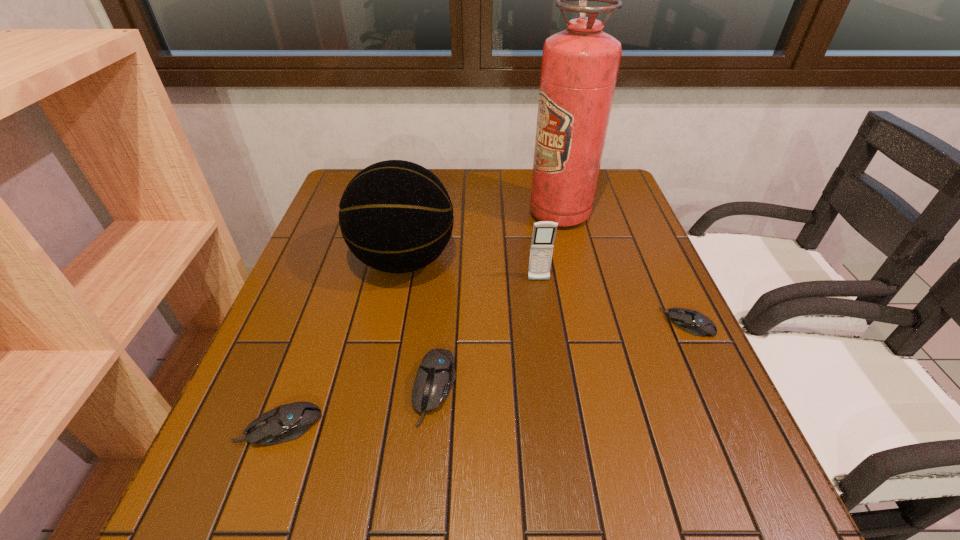
The width and height of the screenshot is (960, 540). I want to click on free space located on the back of the farthest computer mouse, so click(x=670, y=286).

Locate an element on the screen. Image resolution: width=960 pixels, height=540 pixels. free space located 0.060m on the right of the basketball is located at coordinates (479, 260).

Locate an element on the screen. vacant area situated on the label side of the tallest object is located at coordinates (468, 213).

Find the location of a particular element. This screenshot has width=960, height=540. free space located 0.140m on the label side of the tallest object is located at coordinates (481, 213).

Where is `free region located 0.390m on the label side of the tallest object`? This screenshot has height=540, width=960. free region located 0.390m on the label side of the tallest object is located at coordinates (395, 213).

At what (x,y) coordinates should I click in order to perform the action: click on blank space located on the front-facing side of the cellular telephone. Please return your answer as a coordinate pair (x, y). This screenshot has width=960, height=540. Looking at the image, I should click on (552, 373).

Image resolution: width=960 pixels, height=540 pixels. What are the coordinates of `object that is at the far edge` in the screenshot? It's located at (580, 65).

The image size is (960, 540). I want to click on computer mouse at the left edge, so click(286, 422).

The width and height of the screenshot is (960, 540). I want to click on basketball at the left edge, so click(396, 216).

Where is `computer mouse present at the right edge`? The image size is (960, 540). computer mouse present at the right edge is located at coordinates (691, 321).